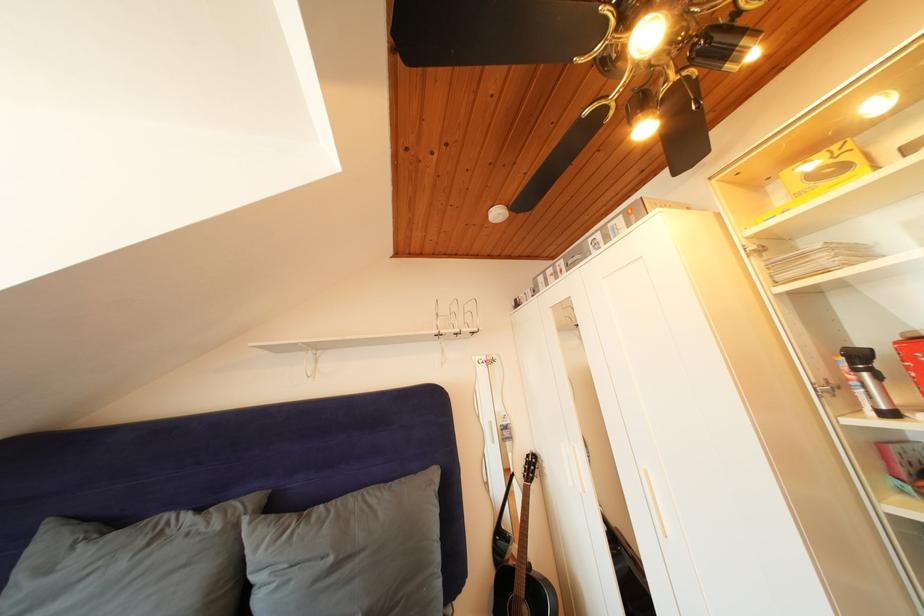
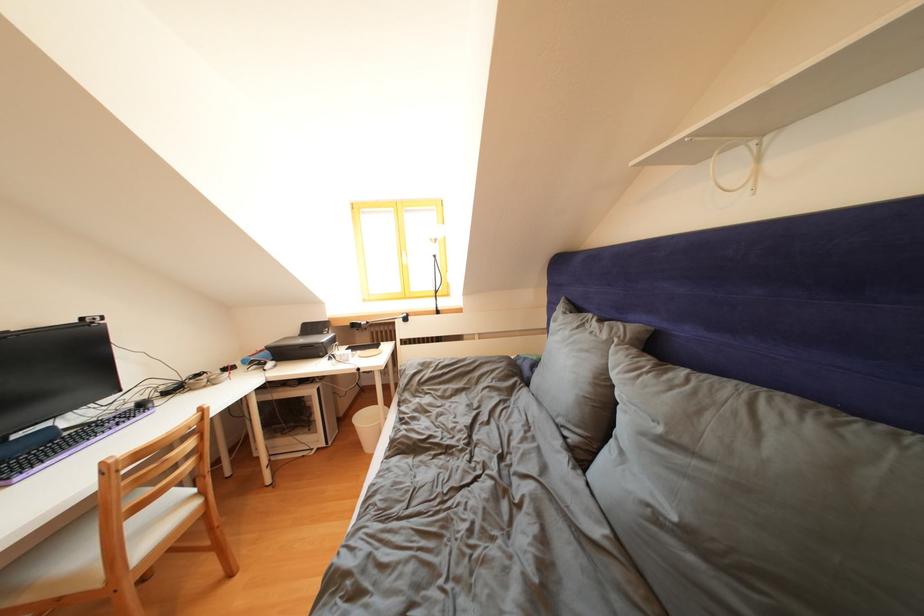
Where in the second image is the point corresponding to pixel 338 565 from the first image?

(667, 435)